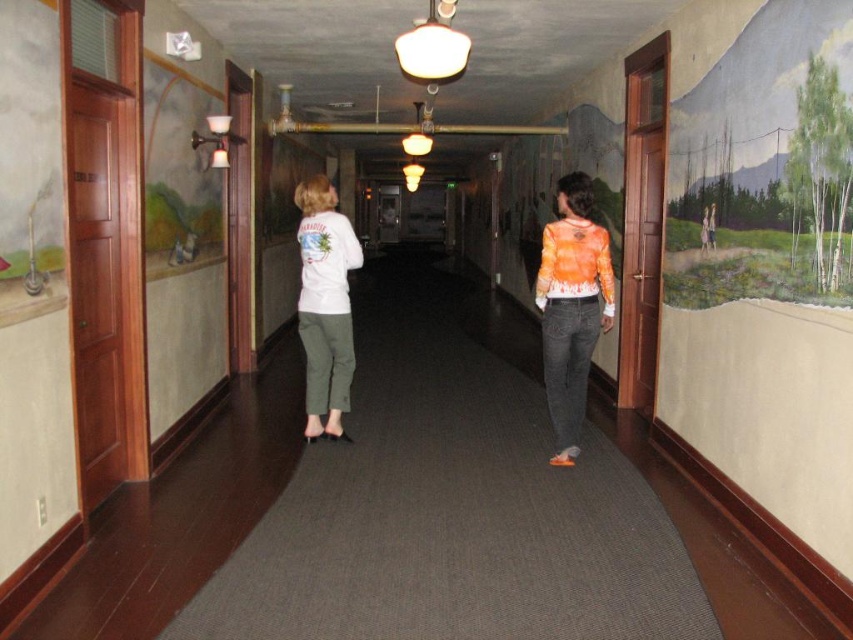
Does orange tie-dye shirt at center have a greater height compared to white matte shirt at center?

Indeed, orange tie-dye shirt at center has a greater height compared to white matte shirt at center.

Which is below, orange tie-dye shirt at center or white matte shirt at center?

orange tie-dye shirt at center is below.

Between point (583, 355) and point (352, 360), which one is positioned behind?

Positioned behind is point (352, 360).

Where is `orange tie-dye shirt at center`? The image size is (853, 640). orange tie-dye shirt at center is located at coordinates (572, 307).